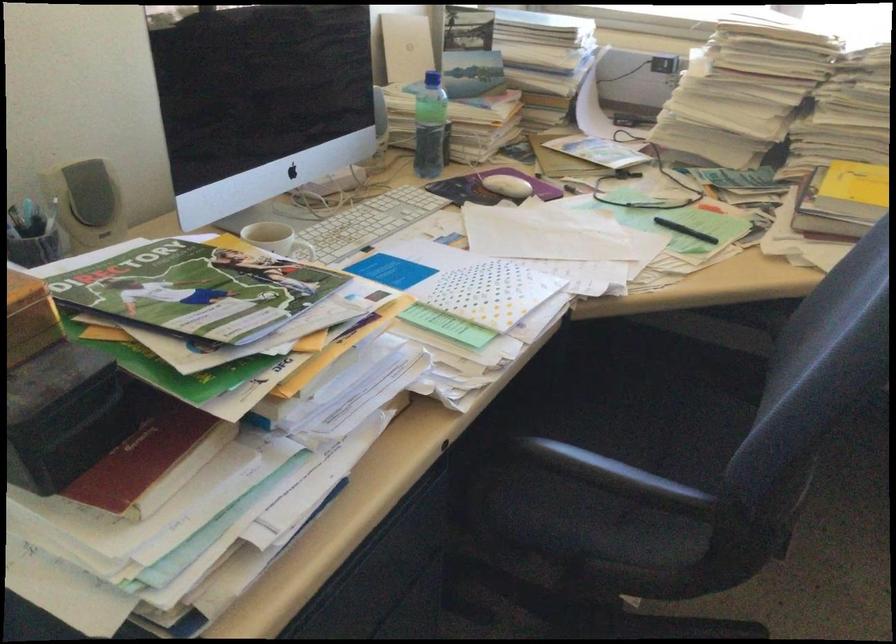
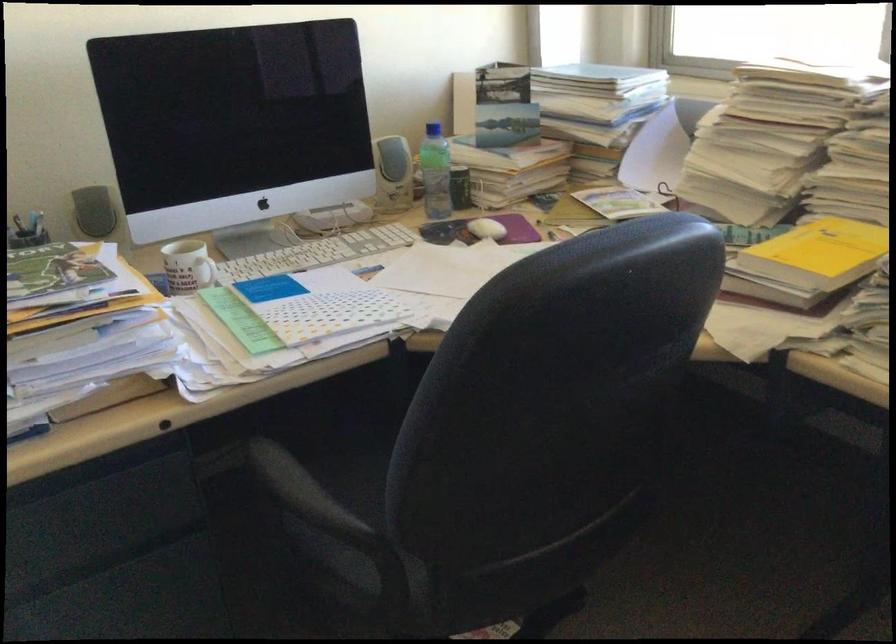
Locate, in the second image, the point that corresponds to pixel 382 129 in the first image.

(392, 174)